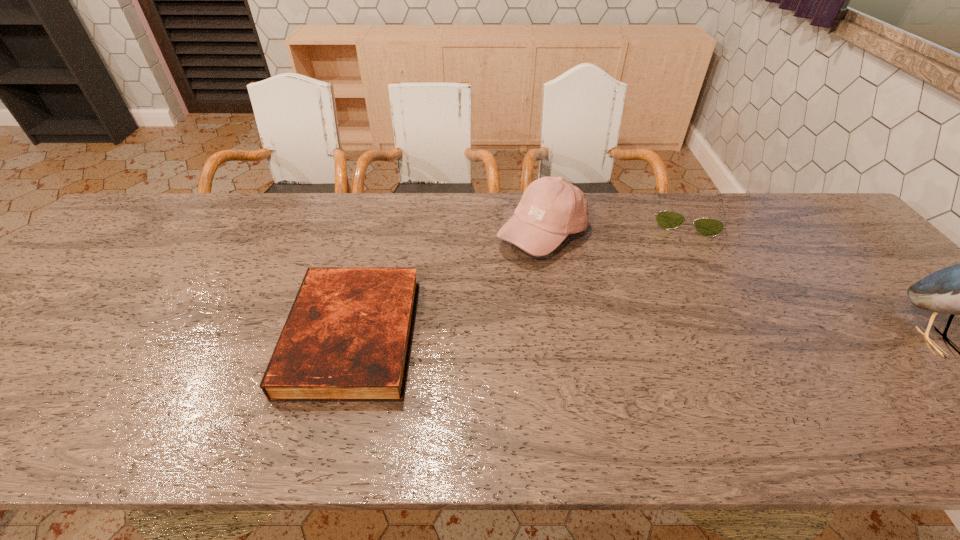
Locate an element on the screen. The image size is (960, 540). vacant space at the far left corner is located at coordinates (152, 240).

Image resolution: width=960 pixels, height=540 pixels. Identify the location of free spot between the second object from right to left and the Bible. (519, 275).

This screenshot has width=960, height=540. I want to click on unoccupied area between the second object from left to right and the sunglasses, so [613, 225].

This screenshot has width=960, height=540. I want to click on vacant space in between the third object from left to right and the baseball cap, so click(x=613, y=225).

What are the coordinates of `free space between the second object from right to left and the leftmost object` in the screenshot? It's located at click(x=519, y=275).

Identify the location of empty space that is in between the third object from right to left and the leftmost object. (447, 285).

The image size is (960, 540). What are the coordinates of `unoccupied position between the second object from left to right and the sunglasses` in the screenshot? It's located at (613, 225).

Identify the location of empty space that is in between the Bible and the second object from right to left. (519, 275).

Identify the location of free spot between the sunglasses and the third object from right to left. (613, 225).

Image resolution: width=960 pixels, height=540 pixels. I want to click on free area in between the Bible and the second object from right to left, so click(x=519, y=275).